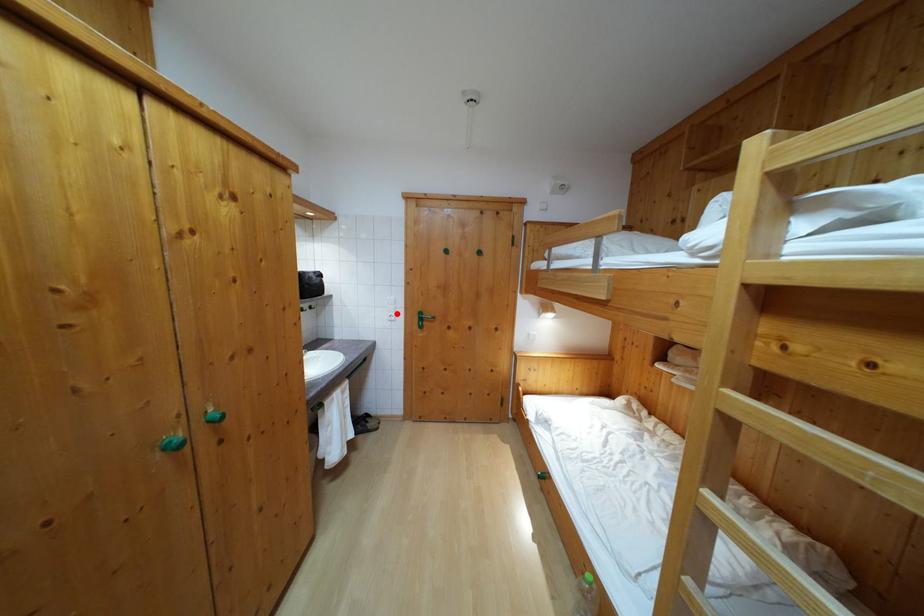
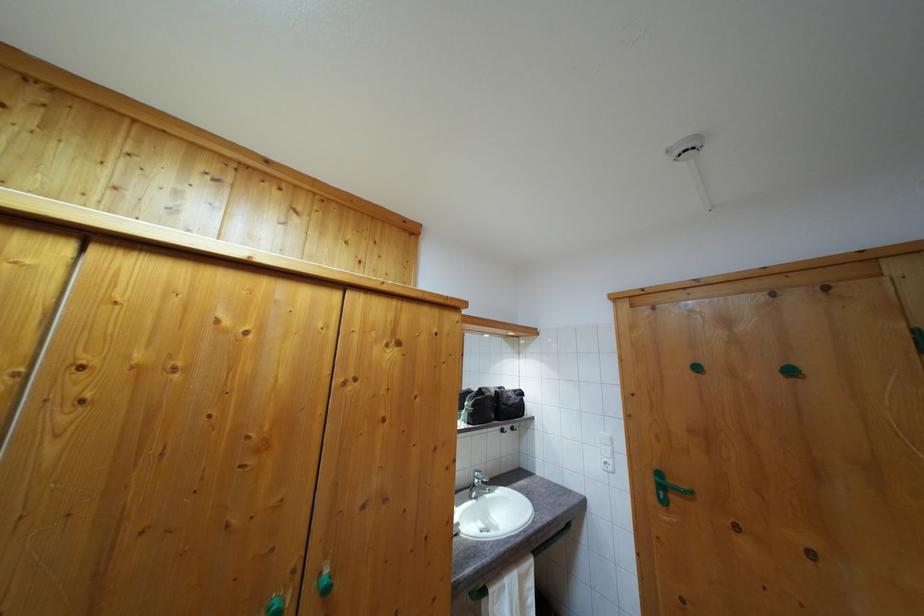
Locate, in the second image, the point that corresponds to the highlighted location in the first image.

(613, 456)